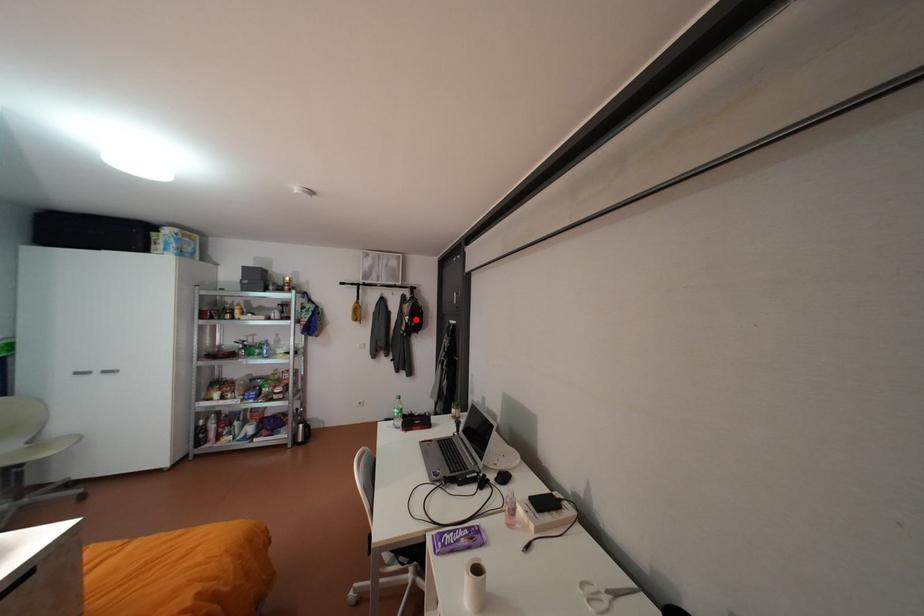
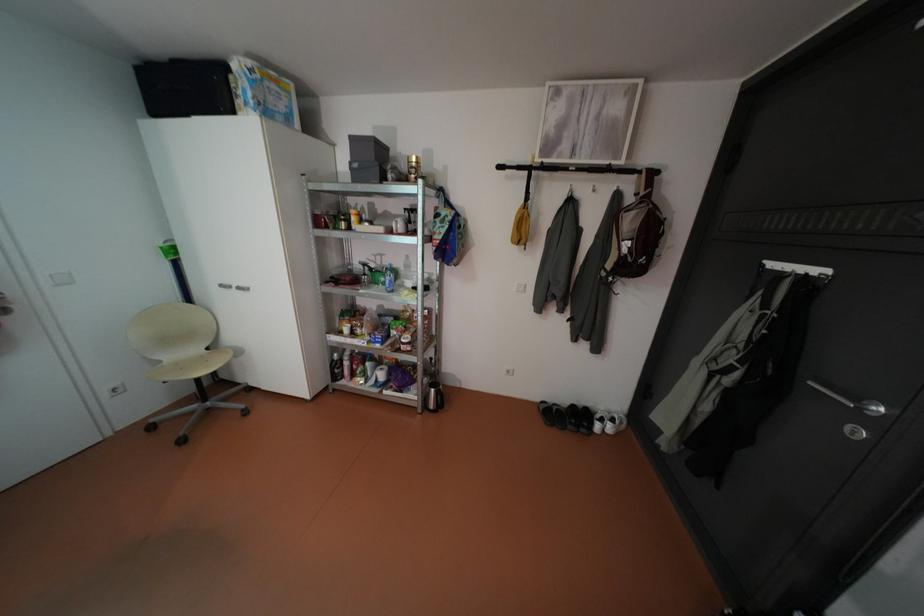
Find the pixel in the second image that matches the highlighted location in the first image.

(634, 249)